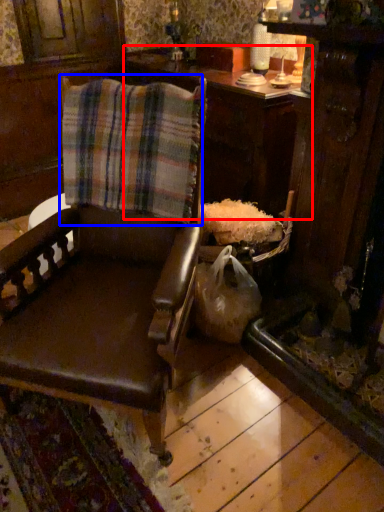
Question: Which point is further to the camera, table (highlighted by a red box) or flannel (highlighted by a blue box)?

Choices:
 (A) table
 (B) flannel

Answer: (A)